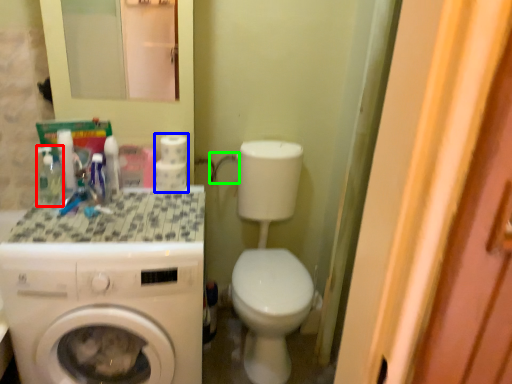
Question: Which object is positioned closest to mouthwash (highlighted by a red box)? Select from toilet paper (highlighted by a blue box) and faucet (highlighted by a green box).

Choices:
 (A) toilet paper
 (B) faucet

Answer: (A)